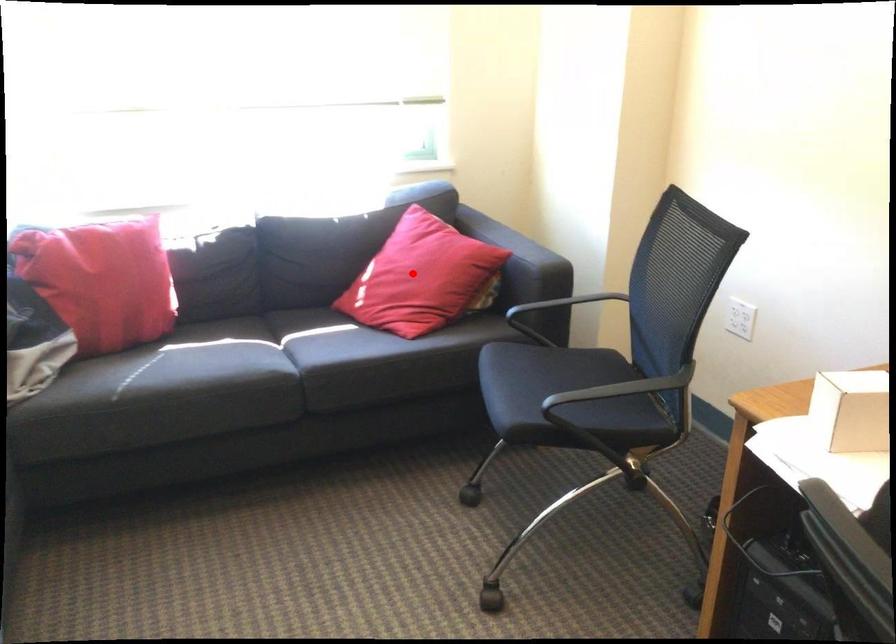
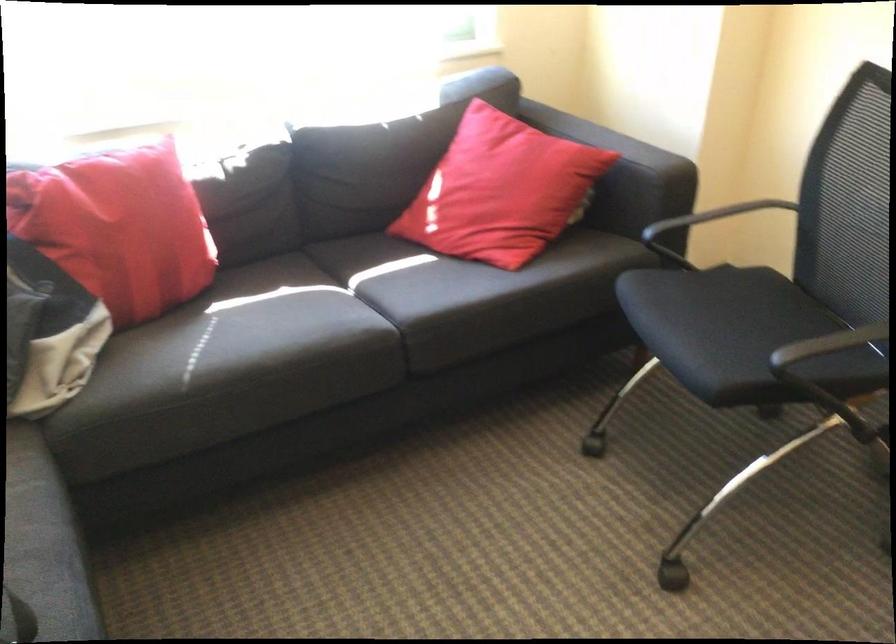
Question: I am providing you with two images of the same scene from different viewpoints. Given a red point in image1, look at the same physical point in image2. Is it:

Choices:
 (A) Closer to the viewpoint
 (B) Farther from the viewpoint

Answer: (A)